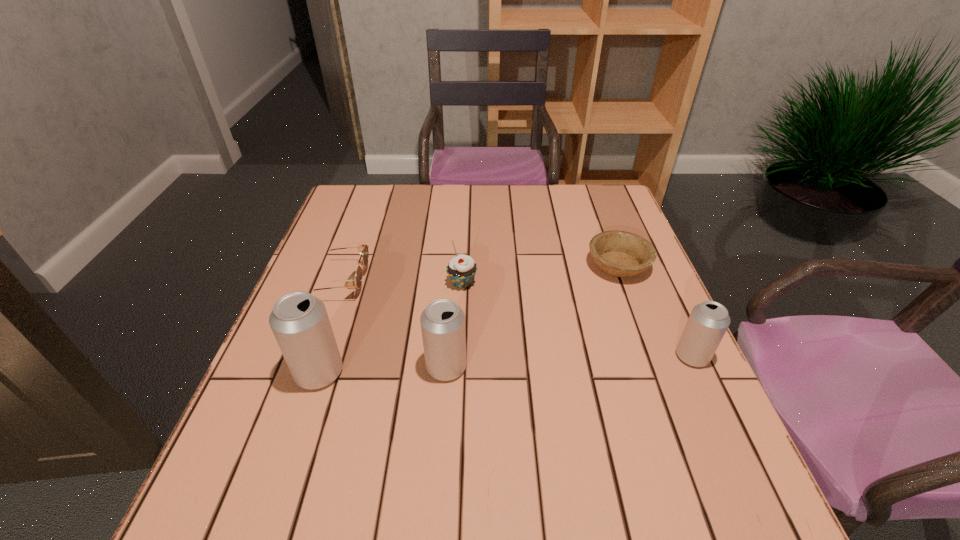
Where is `free space between the second beer can from left to right and the rightmost beer can`? Image resolution: width=960 pixels, height=540 pixels. free space between the second beer can from left to right and the rightmost beer can is located at coordinates (569, 361).

Where is `vacant space that's between the shortest object and the leftmost beer can`? vacant space that's between the shortest object and the leftmost beer can is located at coordinates (468, 319).

Choose which object is the second nearest neighbor to the leftmost beer can. Please provide its 2D coordinates. Your answer should be formatted as a tuple, i.e. [(x, y)], where the tuple contains the x and y coordinates of a point satisfying the conditions above.

[(442, 322)]

Identify the location of the fourth closest object to the fourth tallest object. pos(619,253).

Where is `beer can that is the closest one to the bowl`? The image size is (960, 540). beer can that is the closest one to the bowl is located at coordinates (708, 322).

Identify which beer can is the nearest to the sunglasses. Please provide its 2D coordinates. Your answer should be formatted as a tuple, i.e. [(x, y)], where the tuple contains the x and y coordinates of a point satisfying the conditions above.

[(299, 321)]

The height and width of the screenshot is (540, 960). In order to click on vacant space that satisfies the following two spatial constraints: 1. on the back side of the cupcake; 2. on the front lenses of the fifth tallest object in this screenshot , I will do pyautogui.click(x=463, y=281).

Find the location of a particular element. free space that satisfies the following two spatial constraints: 1. on the back side of the bowl; 2. on the right side of the cupcake is located at coordinates (463, 265).

Find the location of a particular element. free space in the image that satisfies the following two spatial constraints: 1. on the back side of the leftmost beer can; 2. on the left side of the second beer can from left to right is located at coordinates (321, 367).

Where is `vacant position in the image that satisfies the following two spatial constraints: 1. on the front lenses of the sunglasses; 2. on the left side of the third shortest object`? The image size is (960, 540). vacant position in the image that satisfies the following two spatial constraints: 1. on the front lenses of the sunglasses; 2. on the left side of the third shortest object is located at coordinates (339, 283).